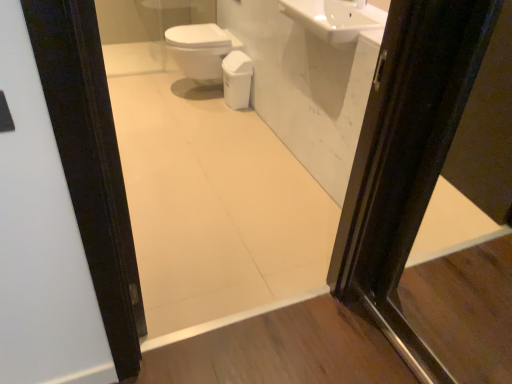
Question: Is white glossy mirror at upper center closer to the viewer compared to white glossy toilet bowl at center?

Choices:
 (A) no
 (B) yes

Answer: (B)

Question: Is white glossy mirror at upper center outside of white glossy toilet bowl at center?

Choices:
 (A) yes
 (B) no

Answer: (A)

Question: Is white glossy mirror at upper center facing away from white glossy toilet bowl at center?

Choices:
 (A) yes
 (B) no

Answer: (B)

Question: Can you confirm if white glossy mirror at upper center is shorter than white glossy toilet bowl at center?

Choices:
 (A) no
 (B) yes

Answer: (A)

Question: Is white glossy toilet bowl at center surrounded by white glossy mirror at upper center?

Choices:
 (A) yes
 (B) no

Answer: (B)

Question: Is white glossy mirror at upper center to the right of white glossy toilet bowl at center from the viewer's perspective?

Choices:
 (A) yes
 (B) no

Answer: (A)

Question: Is white glossy mirror at upper center positioned far away from white glossy sink at upper center?

Choices:
 (A) no
 (B) yes

Answer: (A)

Question: Is white glossy mirror at upper center oriented away from white glossy sink at upper center?

Choices:
 (A) no
 (B) yes

Answer: (A)

Question: Does white glossy mirror at upper center have a lesser height compared to white glossy sink at upper center?

Choices:
 (A) yes
 (B) no

Answer: (B)

Question: Are white glossy mirror at upper center and white glossy sink at upper center making contact?

Choices:
 (A) no
 (B) yes

Answer: (A)

Question: Can you confirm if white glossy mirror at upper center is positioned to the left of white glossy sink at upper center?

Choices:
 (A) no
 (B) yes

Answer: (B)

Question: Considering the relative sizes of white glossy mirror at upper center and white glossy sink at upper center in the image provided, is white glossy mirror at upper center bigger than white glossy sink at upper center?

Choices:
 (A) yes
 (B) no

Answer: (A)

Question: Would you consider white glossy bidet at center to be distant from white glossy mirror at upper center?

Choices:
 (A) no
 (B) yes

Answer: (A)